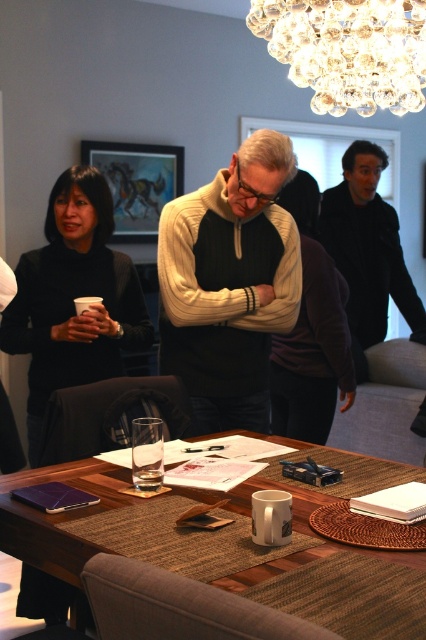
You are standing in the dining room and want to pick up an item located at point (267, 260). If your arm can reach 2 meters, will you be able to reach it?

The point (267, 260) is 2.22 meters away from the camera, so it is beyond your arm reach of 2 meters. You cannot reach it.

You are a guest at this gathering and want to pick up the white knit sweater at center and the black matte sweater at left. Which one can you reach first without moving your position?

The white knit sweater at center is closer to the viewer than the black matte sweater at left, so you can reach it first without moving.

You are organizing a closet and need to place the white knit sweater at center and the black matte sweater at left. Since the closet shelf has limited vertical space, can you stack them vertically without folding?

The white knit sweater at center is above the black matte sweater at left, so they are already stacked vertically. Therefore, you can place them in the closet shelf as they are without folding.